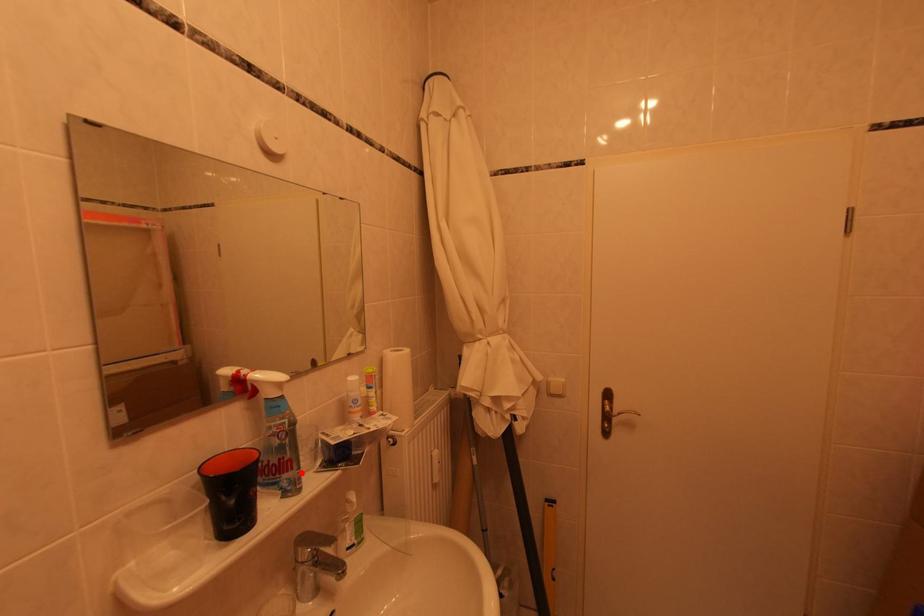
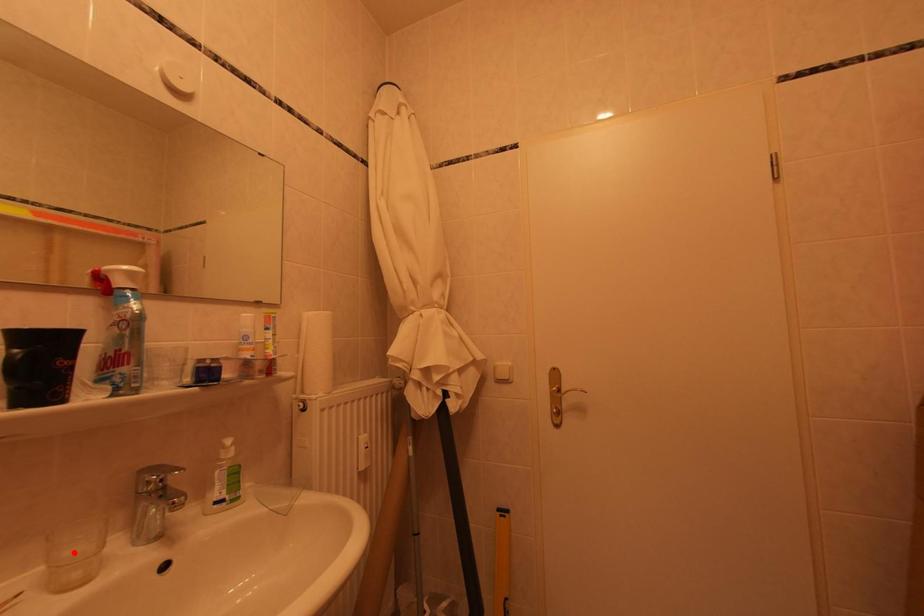
I am providing you with two images of the same scene from different viewpoints. A red point is marked on the first image and another point is marked on the second image. Is the marked point in image1 the same physical position as the marked point in image2?

No